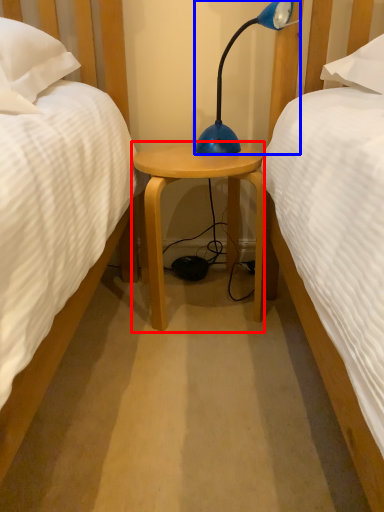
Question: Which point is closer to the camera, nightstand (highlighted by a red box) or lamp (highlighted by a blue box)?

Choices:
 (A) nightstand
 (B) lamp

Answer: (B)